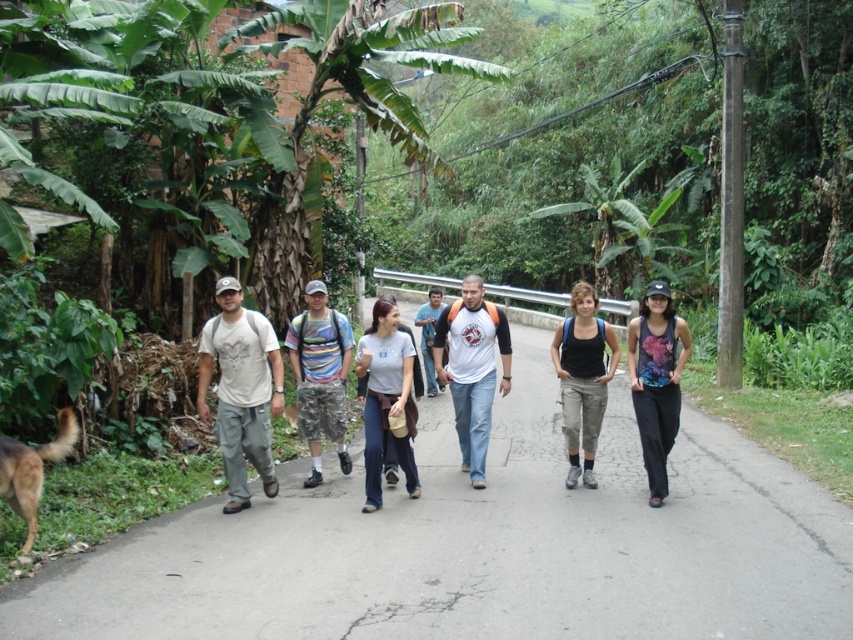
You are standing at the origin point of the coordinate system in the image. You want to move towards the matte khaki pants at center. What direction should you move in?

The matte khaki pants at center is located at coordinate point 0.609 on the x axis and 0.284 on the y axis, so you should move towards the right and slightly forward to reach it.